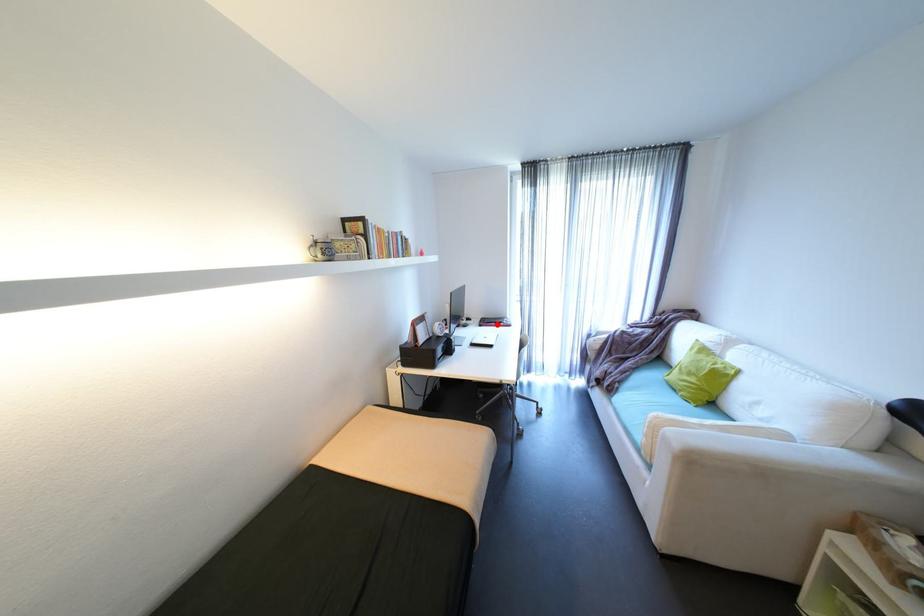
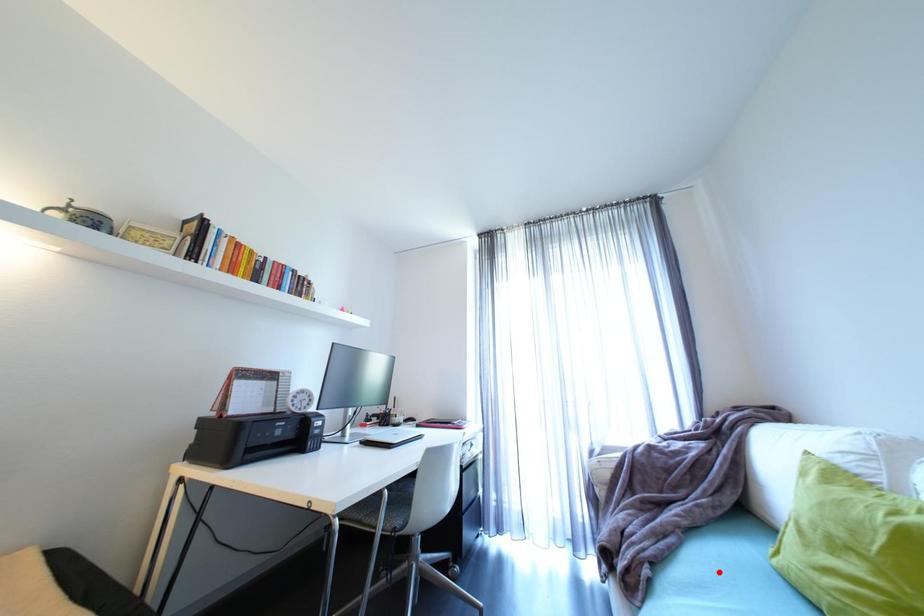
I am providing you with two images of the same scene from different viewpoints. A red point is marked on the first image and another point is marked on the second image. Does the point marked in image1 correspond to the same location as the one in image2?

No